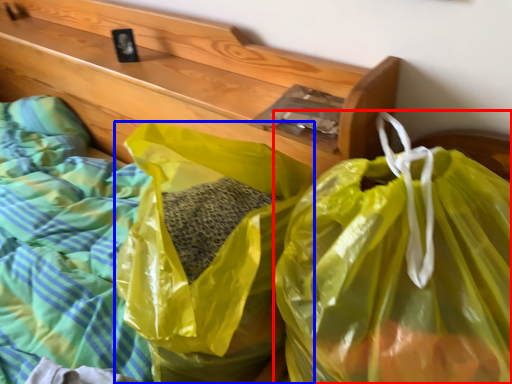
Question: Which of the following is the closest to the observer, plastic bag (highlighted by a red box) or plastic bag (highlighted by a blue box)?

Choices:
 (A) plastic bag
 (B) plastic bag

Answer: (A)